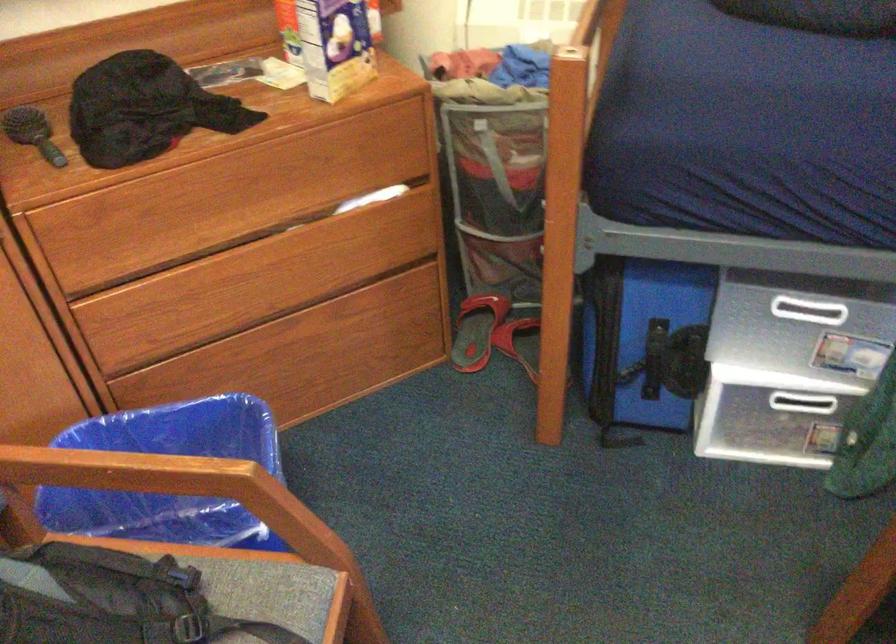
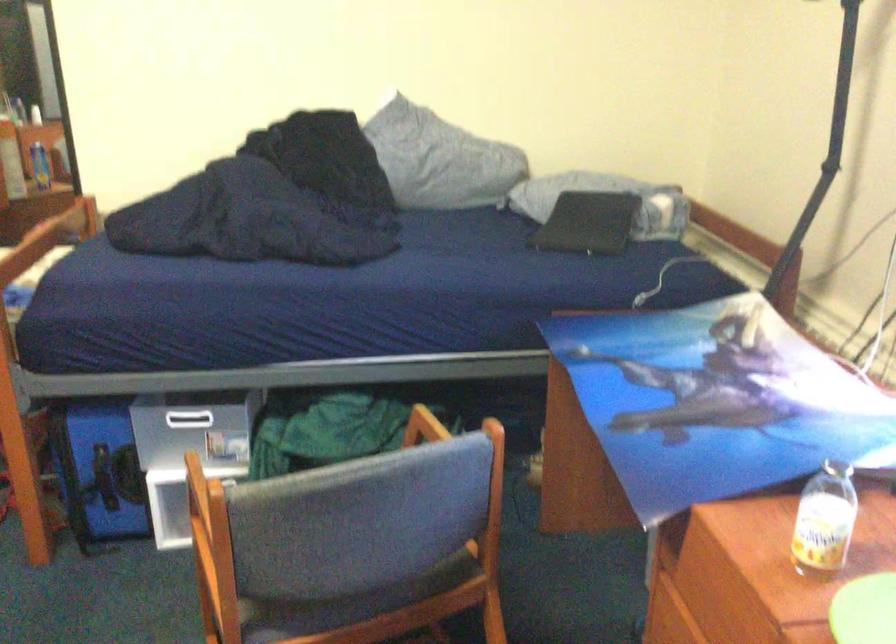
Which direction would the cameraman need to move to produce the second image?

The movement direction of the cameraman is right, backward.